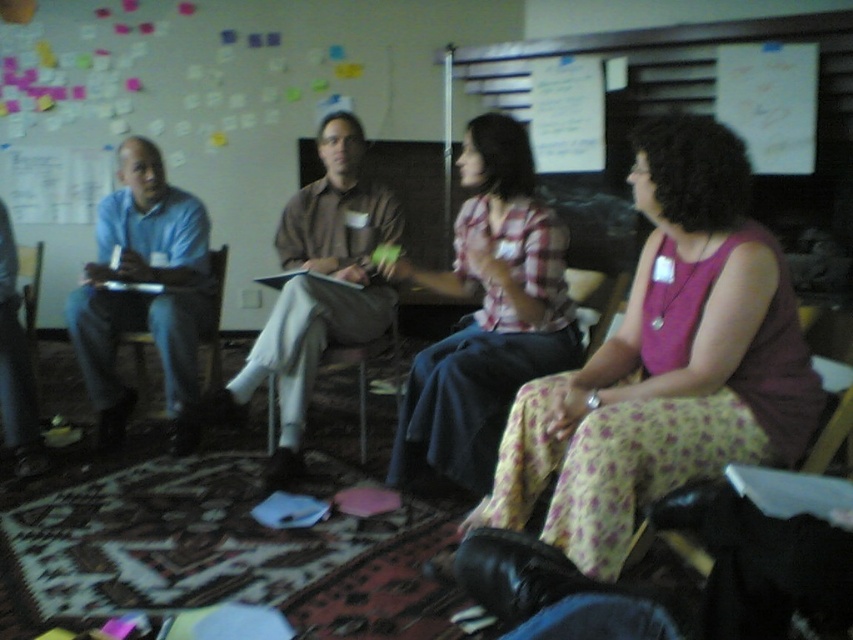
You are a photographer trying to capture a candid shot of the plaid fabric shirt at center and the matte wood armchair at left. Since the lighting is dim, you want to ensure both subjects are visible. Based on their positions, which subject should you focus on first to ensure it appears in the foreground?

The plaid fabric shirt at center is in front of the matte wood armchair at left, so you should focus on the plaid fabric shirt at center first to ensure it appears in the foreground.

You are a photographer setting up for a group photo in this room. You need to position yourself so that both the floral print skirt at center and the matte wood armchair at left are visible in your frame. Based on their positions, which object should be placed to the left in your camera view?

The floral print skirt at center is positioned on the right side of the matte wood armchair at left, so in the camera view, the matte wood armchair at left should be on the left and the floral print skirt at center on the right.